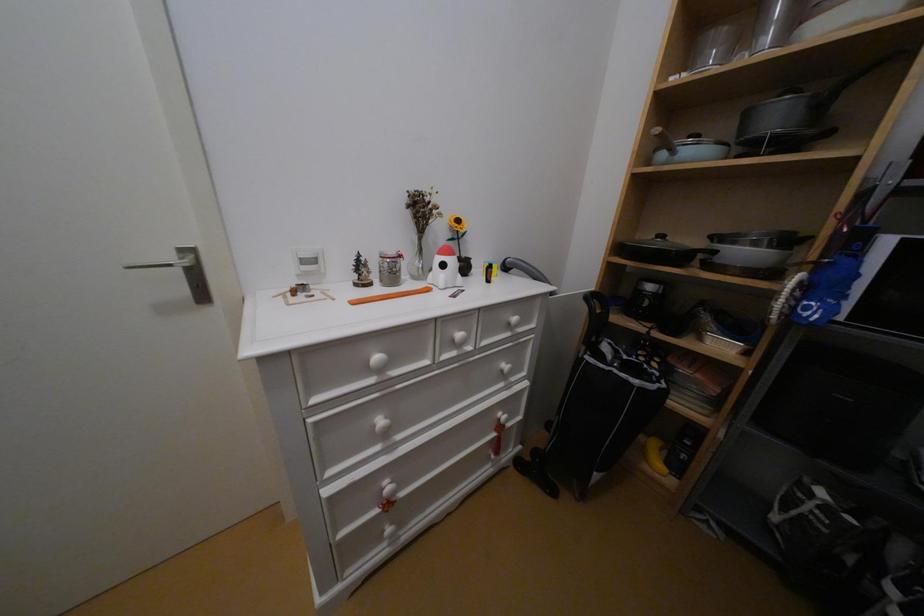
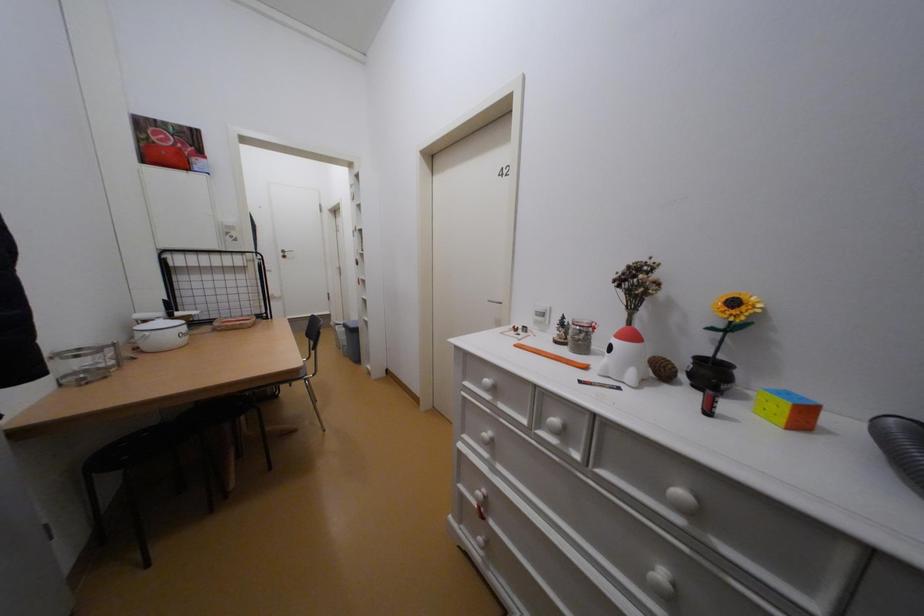
Question: The camera is either moving clockwise (left) or counter-clockwise (right) around the object. The first image is from the beginning of the video and the second image is from the end. Is the camera moving left or right when shooting the video?

Choices:
 (A) Left
 (B) Right

Answer: (B)